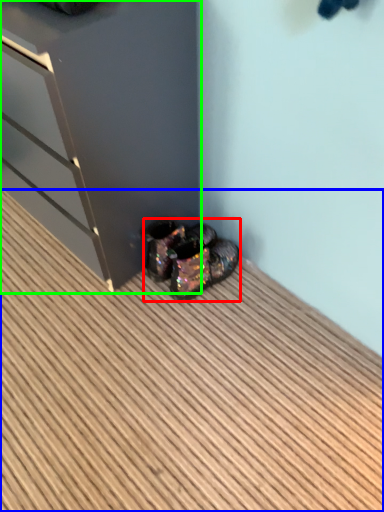
Question: Based on their relative distances, which object is farther from footwear (highlighted by a red box)? Choose from hardwood (highlighted by a blue box) and dresser (highlighted by a green box).

Choices:
 (A) hardwood
 (B) dresser

Answer: (A)